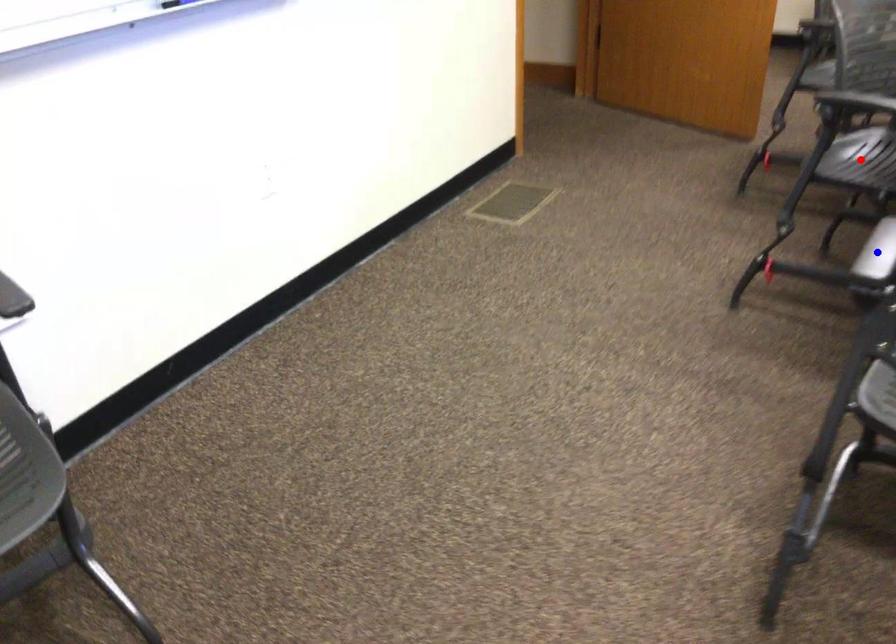
Question: Two points are marked on the image. Which point is closer to the camera?

Choices:
 (A) Blue point is closer.
 (B) Red point is closer.

Answer: (A)